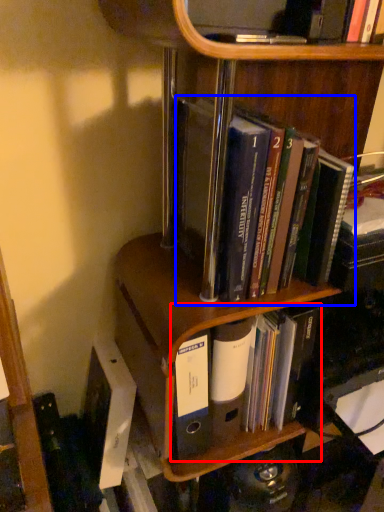
Question: Which point is further to the camera, book (highlighted by a red box) or book (highlighted by a blue box)?

Choices:
 (A) book
 (B) book

Answer: (A)